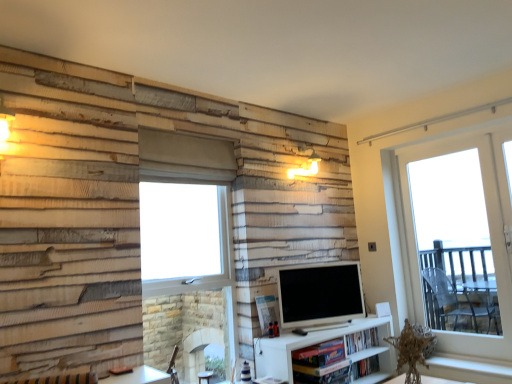
Question: Is matte white tv at center positioned with its back to white wood window sill at lower right?

Choices:
 (A) yes
 (B) no

Answer: (B)

Question: Could you tell me if matte white tv at center is turned towards white wood window sill at lower right?

Choices:
 (A) no
 (B) yes

Answer: (A)

Question: Considering the relative sizes of matte white tv at center and white wood window sill at lower right in the image provided, is matte white tv at center bigger than white wood window sill at lower right?

Choices:
 (A) yes
 (B) no

Answer: (A)

Question: Does matte white tv at center have a smaller size compared to white wood window sill at lower right?

Choices:
 (A) yes
 (B) no

Answer: (B)

Question: Can you confirm if matte white tv at center is taller than white wood window sill at lower right?

Choices:
 (A) yes
 (B) no

Answer: (A)

Question: From a real-world perspective, is white wood window sill at lower right above or below hardcover book at center?

Choices:
 (A) below
 (B) above

Answer: (A)

Question: Is white wood window sill at lower right in front of or behind hardcover book at center in the image?

Choices:
 (A) behind
 (B) front

Answer: (B)

Question: Looking at their shapes, would you say white wood window sill at lower right is wider or thinner than hardcover book at center?

Choices:
 (A) wide
 (B) thin

Answer: (A)

Question: Looking at the image, does white wood window sill at lower right seem bigger or smaller compared to hardcover book at center?

Choices:
 (A) big
 (B) small

Answer: (A)

Question: Is matte white tv at center to the left or to the right of hardcover book at center in the image?

Choices:
 (A) left
 (B) right

Answer: (A)

Question: Would you say matte white tv at center is inside or outside hardcover book at center?

Choices:
 (A) inside
 (B) outside

Answer: (B)

Question: Is point (283, 296) closer or farther from the camera than point (373, 334)?

Choices:
 (A) closer
 (B) farther

Answer: (A)

Question: Considering the positions of matte white tv at center and hardcover book at center in the image, is matte white tv at center taller or shorter than hardcover book at center?

Choices:
 (A) short
 (B) tall

Answer: (B)

Question: From a real-world perspective, relative to matte white tv at center, is clear glass window at center, placed as the 2th window when sorted from right to left, vertically above or below?

Choices:
 (A) above
 (B) below

Answer: (A)

Question: Based on their positions, is clear glass window at center, placed as the 2th window when sorted from right to left, located to the left or right of matte white tv at center?

Choices:
 (A) left
 (B) right

Answer: (A)